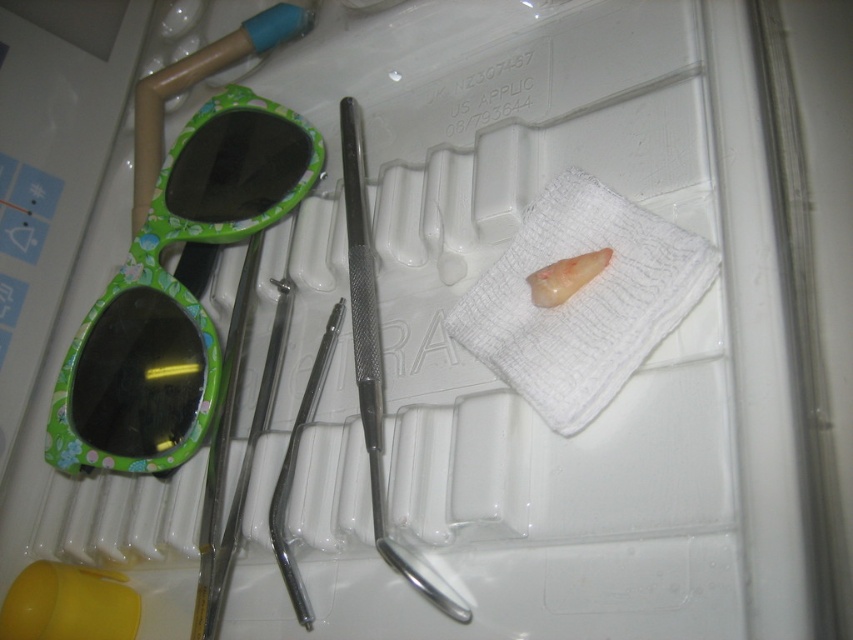
You are a dental assistant who needs to retrieve an item from the tray. You see two points marked on the tray at coordinates point (583, 228) and point (294, 433). Which point is closer to you?

Point (583, 228) is closer to the viewer than point (294, 433).

You are a dental assistant preparing to sterilize the green floral plastic goggles at upper left and the white textured cloth at center. Which item should you prioritize if the sterilization machine has a width limit of 20 cm? Please consider their widths based on the image.

The green floral plastic goggles at upper left might be wider than white textured cloth at center, so you should prioritize sterilizing the white textured cloth at center first to ensure it fits within the machine.

You are a dental assistant who needs to place a tooth on the white textured cloth at center. The tooth is currently on the polished metal forceps at center. Can you place the tooth directly onto the cloth without moving the forceps?

The white textured cloth at center is above the polished metal forceps at center, so yes, you can place the tooth directly onto the cloth without moving the forceps by simply lifting the tooth from the forceps and placing it onto the cloth positioned above.